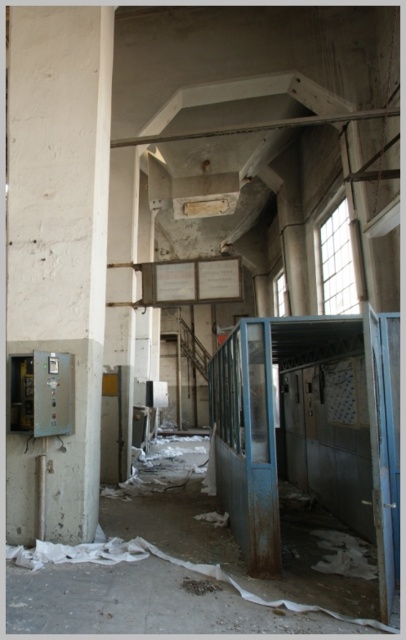
You are a construction worker needing to place a 2 meter wide equipment between the white concrete pillar at left and the rusty metal debris at center. Can you fit it there?

The white concrete pillar at left might be wider than rusty metal debris at center, so the distance between them is uncertain. Therefore, it is unclear if the 2 meter wide equipment can fit there.

You are an inspector checking the abandoned industrial building. You notice the white concrete pillar at left and the rusty metal debris at center. Which object is taller?

The white concrete pillar at left is much taller than the rusty metal debris at center.